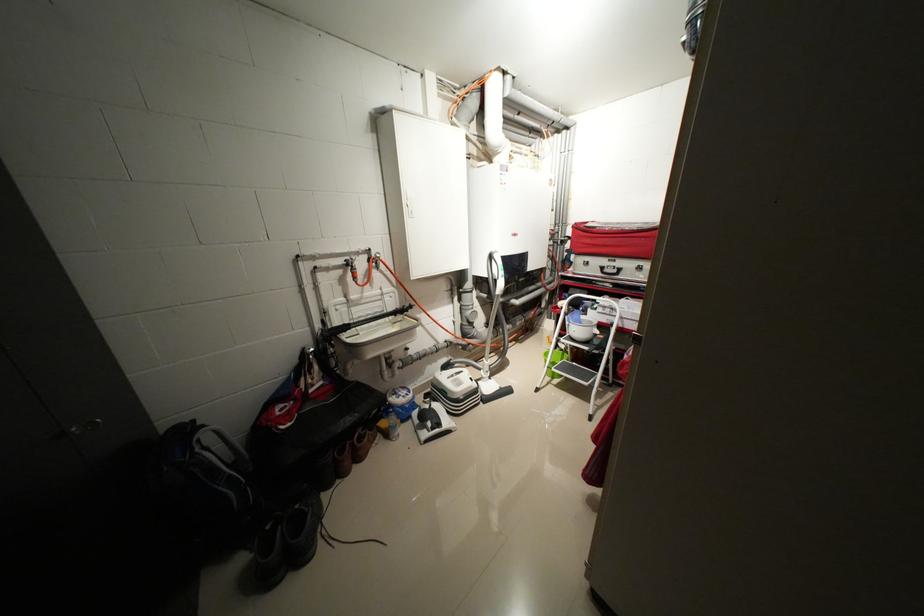
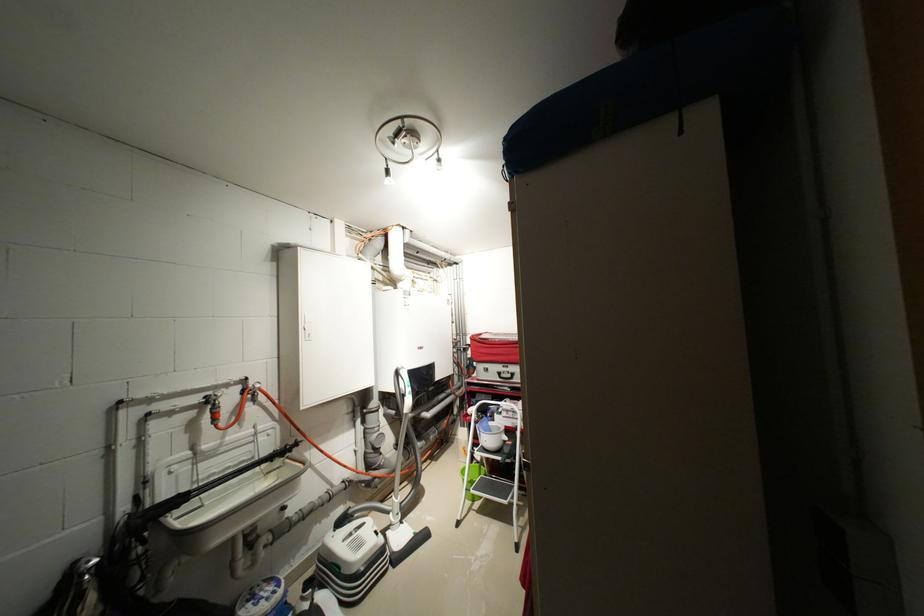
Locate, in the second image, the point that corresponds to (564,232) in the first image.

(466, 341)